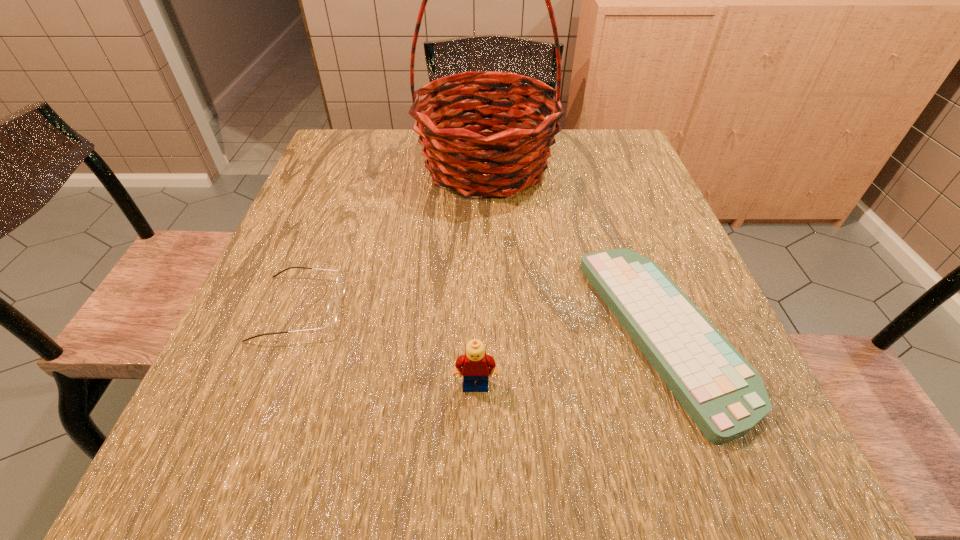
Locate an element on the screen. This screenshot has height=540, width=960. basket is located at coordinates (457, 156).

The height and width of the screenshot is (540, 960). Identify the location of the farthest object. (457, 156).

Identify the location of the third shortest object. (475, 364).

Locate an element on the screen. The height and width of the screenshot is (540, 960). spectacles is located at coordinates pyautogui.click(x=340, y=282).

You are a GUI agent. You are given a task and a screenshot of the screen. Output one action in this format:
    pyautogui.click(x=<x>, y=<y>)
    Task: Click on the third tallest object
    
    Given the screenshot: What is the action you would take?
    pyautogui.click(x=340, y=282)

At what (x,y) coordinates should I click in order to perform the action: click on the rightmost object. Please return your answer as a coordinate pair (x, y). Looking at the image, I should click on (725, 396).

Where is `computer keyboard`? computer keyboard is located at coordinates [x=725, y=396].

This screenshot has width=960, height=540. In order to click on vacant region located on the left of the farthest object in this screenshot , I will do `click(331, 166)`.

Where is `vacant space located 0.150m on the front-facing side of the Lego`? Image resolution: width=960 pixels, height=540 pixels. vacant space located 0.150m on the front-facing side of the Lego is located at coordinates (475, 492).

This screenshot has width=960, height=540. In order to click on vacant area situated 0.250m through the lenses of the third tallest object in this screenshot , I will do `click(475, 308)`.